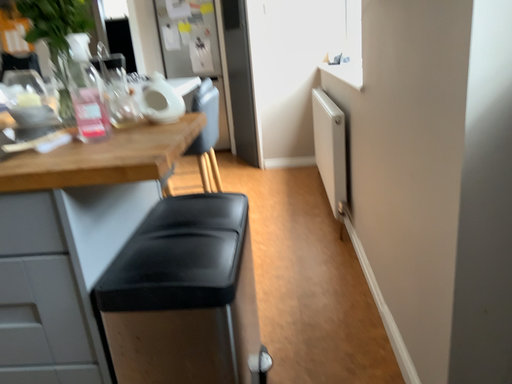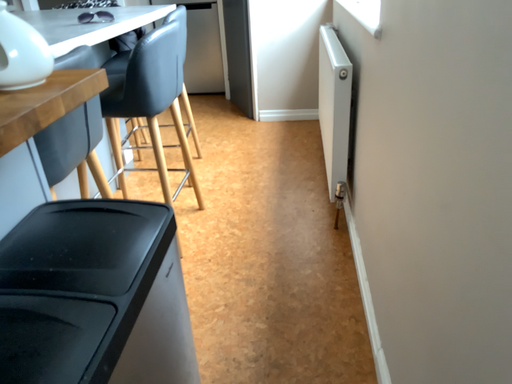
Question: Which way did the camera rotate in the video?

Choices:
 (A) rotated upward
 (B) rotated downward

Answer: (B)